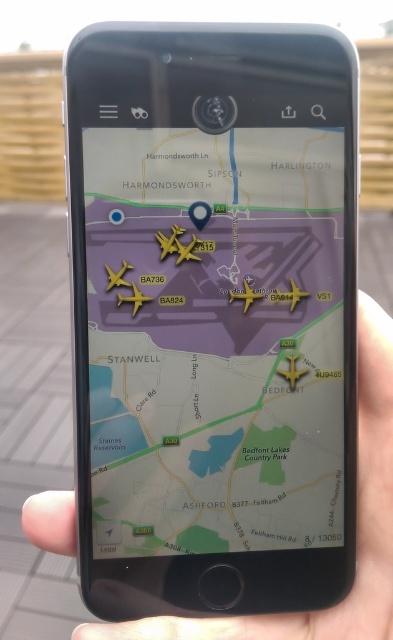
Who is positioned more to the left, black matte smartphone at center or matte gold airplane at center?

Positioned to the left is black matte smartphone at center.

Based on the photo, does black matte smartphone at center appear on the left side of matte gold airplane at center?

Yes, black matte smartphone at center is to the left of matte gold airplane at center.

The height and width of the screenshot is (640, 393). What do you see at coordinates (213, 316) in the screenshot?
I see `black matte smartphone at center` at bounding box center [213, 316].

At what (x,y) coordinates should I click in order to perform the action: click on black matte smartphone at center. Please return your answer as a coordinate pair (x, y). This screenshot has width=393, height=640. Looking at the image, I should click on (213, 316).